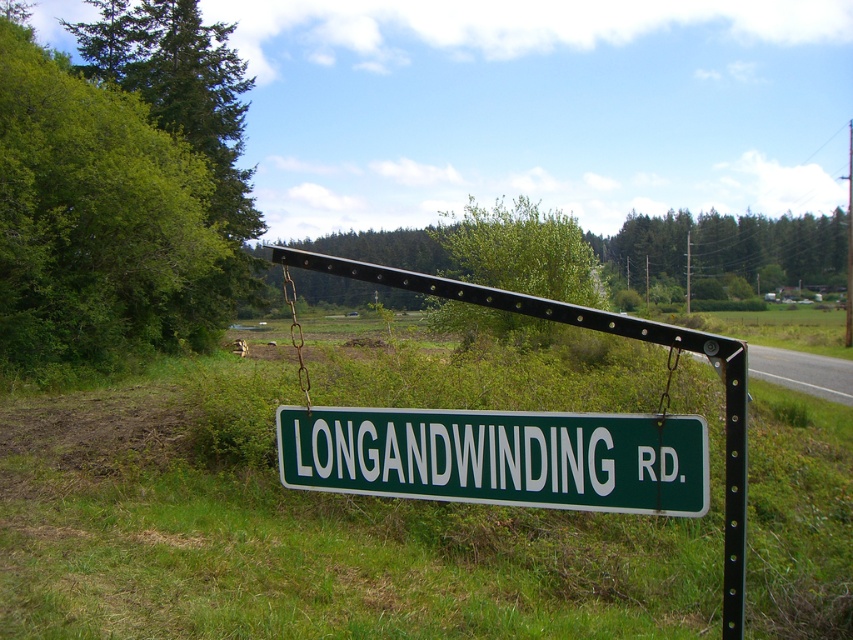
Who is positioned more to the left, green grass at center or green plastic sign at center?

green plastic sign at center

Locate an element on the screen. Image resolution: width=853 pixels, height=640 pixels. green grass at center is located at coordinates (306, 529).

At what (x,y) coordinates should I click in order to perform the action: click on green grass at center. Please return your answer as a coordinate pair (x, y). Looking at the image, I should click on (306, 529).